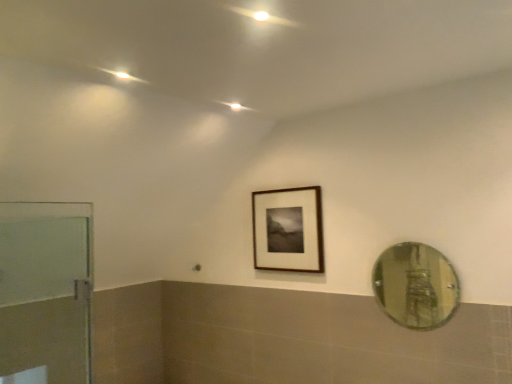
Question: From the image's perspective, is transparent glass door at left above wooden frame at center?

Choices:
 (A) yes
 (B) no

Answer: (B)

Question: Is transparent glass door at left outside of wooden frame at center?

Choices:
 (A) no
 (B) yes

Answer: (B)

Question: Does transparent glass door at left come behind wooden frame at center?

Choices:
 (A) yes
 (B) no

Answer: (B)

Question: Considering the relative sizes of transparent glass door at left and wooden frame at center in the image provided, is transparent glass door at left bigger than wooden frame at center?

Choices:
 (A) yes
 (B) no

Answer: (A)

Question: Is transparent glass door at left at the right side of wooden frame at center?

Choices:
 (A) no
 (B) yes

Answer: (A)

Question: Is transparent glass door at left to the left or to the right of wooden frame at center in the image?

Choices:
 (A) right
 (B) left

Answer: (B)

Question: From their relative heights in the image, would you say transparent glass door at left is taller or shorter than wooden frame at center?

Choices:
 (A) tall
 (B) short

Answer: (A)

Question: Looking at the image, does transparent glass door at left seem bigger or smaller compared to wooden frame at center?

Choices:
 (A) small
 (B) big

Answer: (B)

Question: Does point (52, 324) appear closer or farther from the camera than point (280, 228)?

Choices:
 (A) farther
 (B) closer

Answer: (A)

Question: Is point (251, 200) closer or farther from the camera than point (51, 349)?

Choices:
 (A) farther
 (B) closer

Answer: (A)

Question: Is wooden frame at center taller or shorter than transparent glass door at left?

Choices:
 (A) tall
 (B) short

Answer: (B)

Question: From the image's perspective, is wooden frame at center positioned above or below transparent glass door at left?

Choices:
 (A) below
 (B) above

Answer: (B)

Question: Is wooden frame at center inside the boundaries of transparent glass door at left, or outside?

Choices:
 (A) inside
 (B) outside

Answer: (B)

Question: From their relative heights in the image, would you say green reflective glass mirror at right is taller or shorter than wooden frame at center?

Choices:
 (A) tall
 (B) short

Answer: (B)

Question: From a real-world perspective, is green reflective glass mirror at right physically located above or below wooden frame at center?

Choices:
 (A) above
 (B) below

Answer: (B)